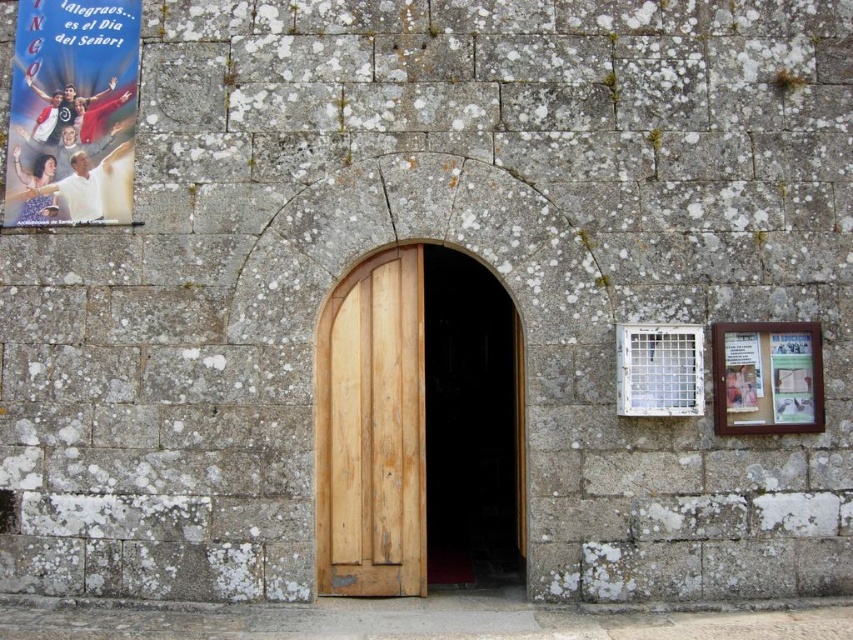
Question: Does light brown wood door at center have a lesser width compared to matte paper poster at upper left?

Choices:
 (A) yes
 (B) no

Answer: (A)

Question: Does light brown wood door at center lie in front of wooden frame at right?

Choices:
 (A) no
 (B) yes

Answer: (A)

Question: Which point is farther to the camera?

Choices:
 (A) (778, 348)
 (B) (399, 253)

Answer: (B)

Question: Which of the following is the closest to the observer?

Choices:
 (A) matte paper poster at upper left
 (B) light brown wood door at center

Answer: (B)

Question: Considering the real-world distances, which object is closest to the matte paper poster at upper left?

Choices:
 (A) light brown wood door at center
 (B) wooden frame at right

Answer: (A)

Question: Is light brown wood door at center wider than wooden frame at right?

Choices:
 (A) yes
 (B) no

Answer: (B)